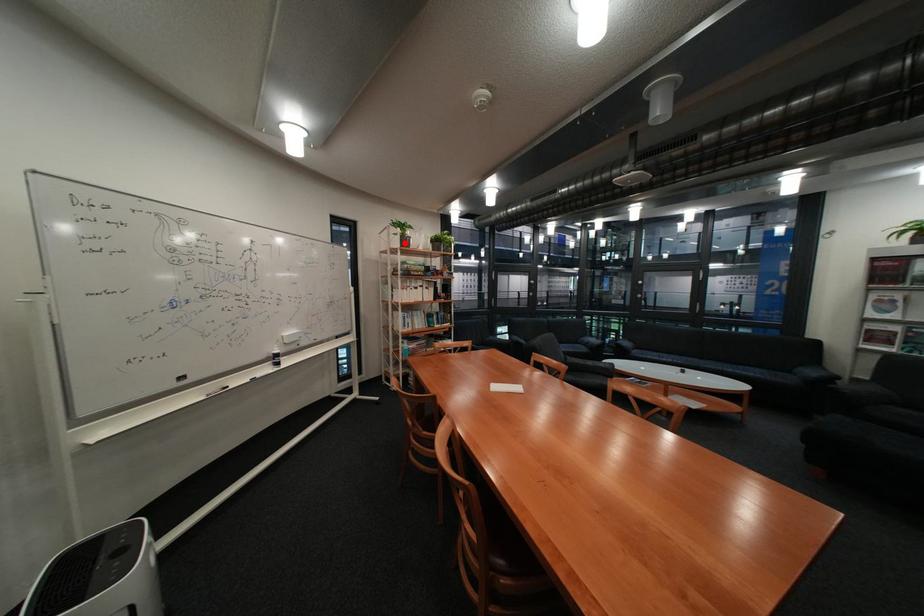
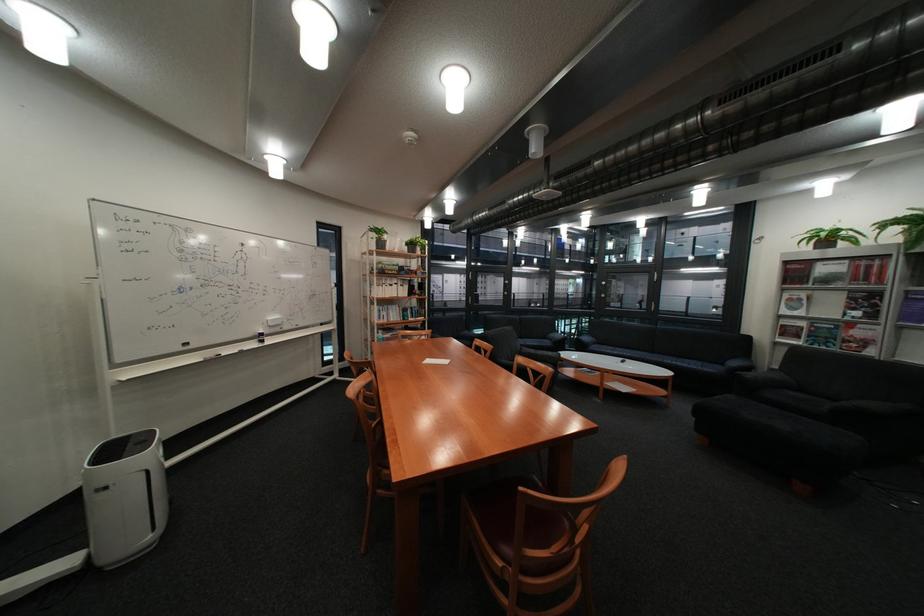
In the second image, find the point that corresponds to the highlighted location in the first image.

(383, 246)